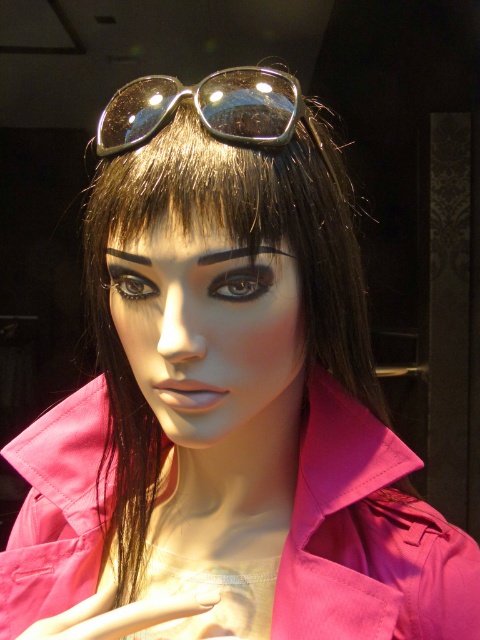
Question: In this image, where is shiny black goggles at upper center located relative to black matte eyebrow at center?

Choices:
 (A) below
 (B) above

Answer: (B)

Question: Among these points, which one is farthest from the camera?

Choices:
 (A) (247, 74)
 (B) (197, 403)
 (C) (131, 253)

Answer: (A)

Question: Is shiny black goggles at upper center to the left of black matte eyebrow at center from the viewer's perspective?

Choices:
 (A) yes
 (B) no

Answer: (A)

Question: Considering the real-world distances, which object is closest to the black matte eyebrow at center?

Choices:
 (A) smooth matte face at center
 (B) shiny black goggles at upper center
 (C) black matte eyebrow at upper center

Answer: (C)

Question: Among these objects, which one is nearest to the camera?

Choices:
 (A) black matte eyebrow at upper center
 (B) black matte eyebrow at center

Answer: (B)

Question: Is smooth matte face at center thinner than shiny black goggles at upper center?

Choices:
 (A) no
 (B) yes

Answer: (B)